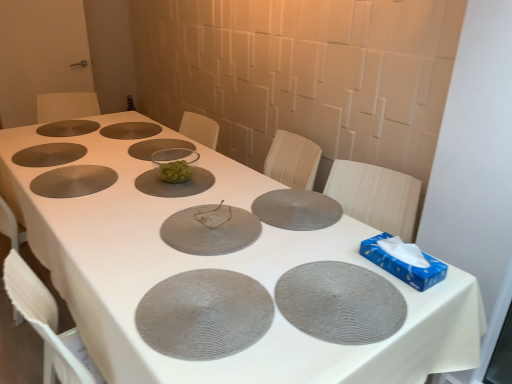
Question: Does matte gray placemat at center, which ranks as the 4th glass plate in front-to-back order, come in front of transparent glass bowl at center, arranged as the 8th glass plate when viewed from the front?

Choices:
 (A) no
 (B) yes

Answer: (B)

Question: Is matte gray placemat at center, acting as the 7th glass plate starting from the back, with transparent glass bowl at center, arranged as the 8th glass plate when viewed from the front?

Choices:
 (A) yes
 (B) no

Answer: (B)

Question: Can you confirm if matte gray placemat at center, acting as the 7th glass plate starting from the back, is taller than transparent glass bowl at center, the third glass plate positioned from the back?

Choices:
 (A) yes
 (B) no

Answer: (B)

Question: Does matte gray placemat at center, acting as the 7th glass plate starting from the back, appear on the right side of transparent glass bowl at center, arranged as the 8th glass plate when viewed from the front?

Choices:
 (A) no
 (B) yes

Answer: (B)

Question: Is transparent glass bowl at center, arranged as the 8th glass plate when viewed from the front, located within matte gray placemat at center, which ranks as the 4th glass plate in front-to-back order?

Choices:
 (A) yes
 (B) no

Answer: (B)

Question: Does matte gray placemat at center, acting as the 7th glass plate starting from the back, have a larger size compared to transparent glass bowl at center, the third glass plate positioned from the back?

Choices:
 (A) no
 (B) yes

Answer: (B)

Question: Is matte brown glass plate at center, which appears as the ninth glass plate when viewed from the front, smaller than matte gray glass plate at upper left, the 10th glass plate positioned from the front?

Choices:
 (A) no
 (B) yes

Answer: (A)

Question: Could you tell me if matte brown glass plate at center, which appears as the second glass plate when viewed from the back, is turned towards matte gray glass plate at upper left, placed as the first glass plate when sorted from back to front?

Choices:
 (A) no
 (B) yes

Answer: (A)

Question: Does matte brown glass plate at center, which appears as the second glass plate when viewed from the back, have a larger size compared to matte gray glass plate at upper left, placed as the first glass plate when sorted from back to front?

Choices:
 (A) no
 (B) yes

Answer: (B)

Question: Would you say matte brown glass plate at center, which appears as the ninth glass plate when viewed from the front, is outside matte gray glass plate at upper left, placed as the first glass plate when sorted from back to front?

Choices:
 (A) yes
 (B) no

Answer: (A)

Question: Is matte brown glass plate at center, which appears as the ninth glass plate when viewed from the front, beside matte gray glass plate at upper left, placed as the first glass plate when sorted from back to front?

Choices:
 (A) yes
 (B) no

Answer: (B)

Question: Considering the relative sizes of matte brown glass plate at center, which appears as the ninth glass plate when viewed from the front, and matte gray glass plate at upper left, placed as the first glass plate when sorted from back to front, in the image provided, is matte brown glass plate at center, which appears as the ninth glass plate when viewed from the front, shorter than matte gray glass plate at upper left, placed as the first glass plate when sorted from back to front,?

Choices:
 (A) no
 (B) yes

Answer: (A)

Question: Does clear glass bowl at center, marked as the 6th glass plate in a front-to-back arrangement, have a greater width compared to matte brown glass plate at center, which appears as the ninth glass plate when viewed from the front?

Choices:
 (A) no
 (B) yes

Answer: (B)